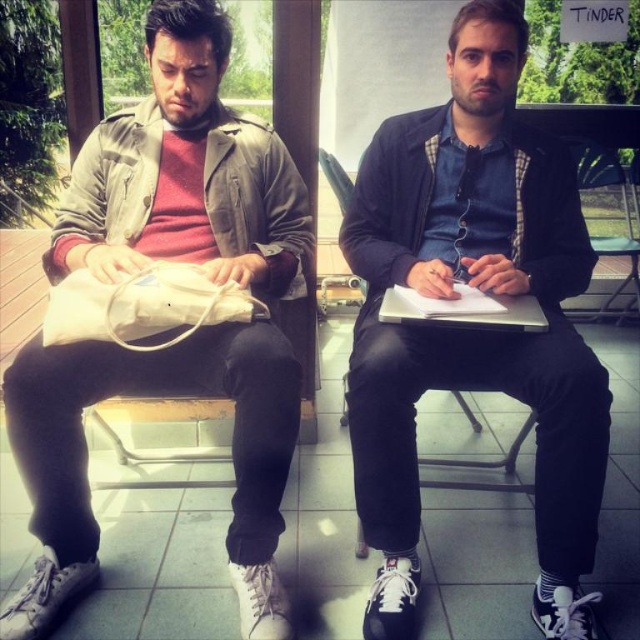
Between matte khaki jacket at center and silver metallic laptop at center, which one has more height?

matte khaki jacket at center is taller.

You are a GUI agent. You are given a task and a screenshot of the screen. Output one action in this format:
    pyautogui.click(x=<x>, y=<y>)
    Task: Click on the matte khaki jacket at center
    Image resolution: width=640 pixels, height=640 pixels.
    Given the screenshot: What is the action you would take?
    (186, 173)

Image resolution: width=640 pixels, height=640 pixels. Identify the location of matte khaki jacket at center. (186, 173).

Does matte black jacket at center lie in front of matte khaki jacket at center?

No, it is not.

Who is lower down, matte black jacket at center or matte khaki jacket at center?

matte black jacket at center

Who is more forward, (384, 252) or (262, 154)?

Positioned in front is point (384, 252).

At what (x,y) coordinates should I click in order to perform the action: click on matte black jacket at center. Please return your answer as a coordinate pair (x, y). The image size is (640, 640). Looking at the image, I should click on (474, 330).

Consider the image. Does matte black jacket at center have a lesser height compared to metallic silver chair at center?

No.

Who is more distant from viewer, (486,385) or (612,186)?

Positioned behind is point (612,186).

Identify the location of matte black jacket at center. The height and width of the screenshot is (640, 640). (474, 330).